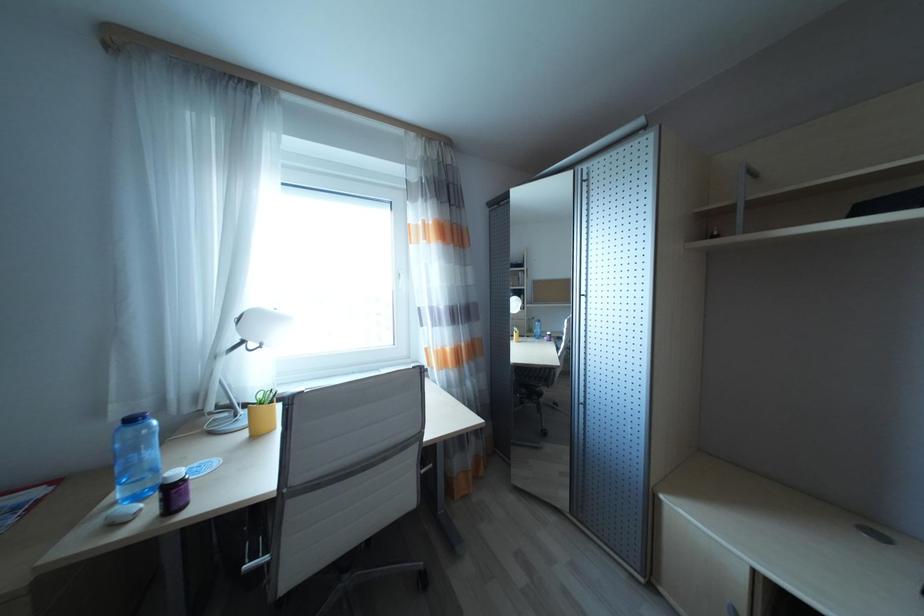
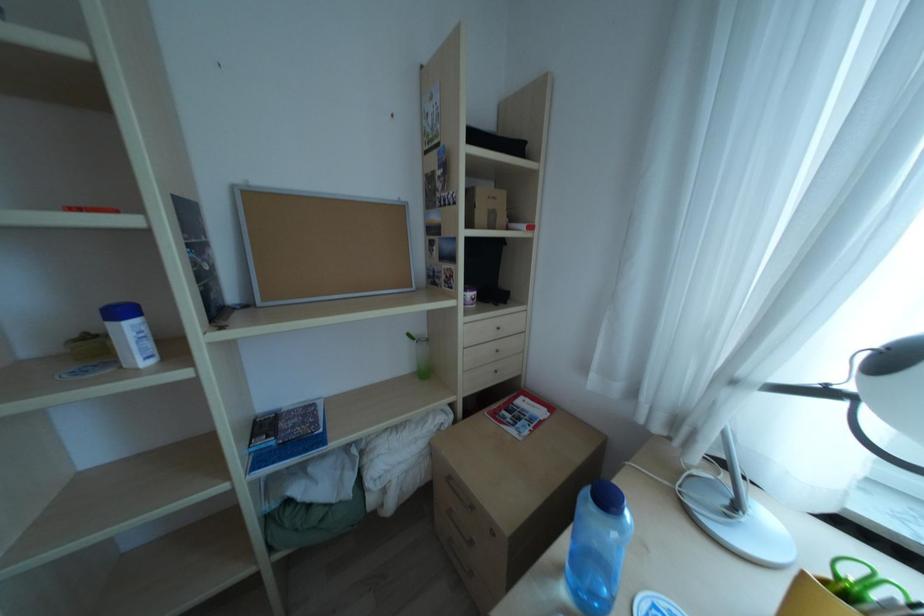
Based on the continuous images, in which direction is the camera rotating?

The camera rotated toward left-down.